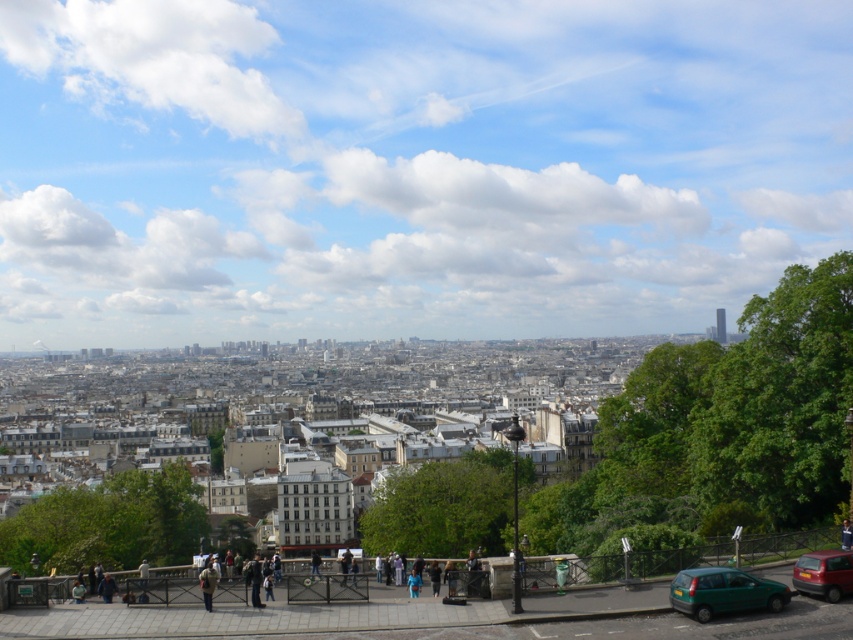
Question: Does green matte car at lower right have a smaller size compared to shiny metallic tower at upper right?

Choices:
 (A) yes
 (B) no

Answer: (A)

Question: Which is farther from the green matte car at lower right?

Choices:
 (A) matte red car at lower right
 (B) shiny metallic tower at upper right

Answer: (B)

Question: Which object is the closest to the shiny metallic tower at upper right?

Choices:
 (A) matte red car at lower right
 (B) green matte car at lower right

Answer: (A)

Question: Considering the relative positions of green matte car at lower right and matte red car at lower right in the image provided, where is green matte car at lower right located with respect to matte red car at lower right?

Choices:
 (A) below
 (B) above

Answer: (A)

Question: Among these objects, which one is farthest from the camera?

Choices:
 (A) shiny metallic tower at upper right
 (B) green matte car at lower right

Answer: (A)

Question: Can you confirm if green matte car at lower right is wider than matte red car at lower right?

Choices:
 (A) yes
 (B) no

Answer: (B)